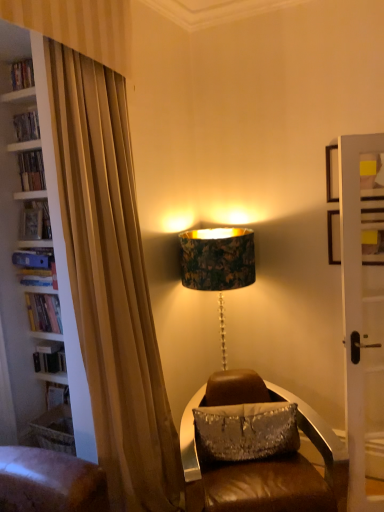
The width and height of the screenshot is (384, 512). What do you see at coordinates (44, 312) in the screenshot?
I see `hardcover book at left, the first book ordered from the bottom` at bounding box center [44, 312].

Describe the element at coordinates (35, 221) in the screenshot. I see `hardcover book at left, acting as the third book starting from the bottom` at that location.

The width and height of the screenshot is (384, 512). What do you see at coordinates (245, 431) in the screenshot?
I see `silver sequined pillow at center` at bounding box center [245, 431].

Image resolution: width=384 pixels, height=512 pixels. Describe the element at coordinates (262, 460) in the screenshot. I see `brown leather chair at center` at that location.

This screenshot has height=512, width=384. Describe the element at coordinates (36, 266) in the screenshot. I see `blue hardcover book at left, the 3th book positioned from the top` at that location.

Locate an element on the screen. The height and width of the screenshot is (512, 384). hardcover book at left, the first book ordered from the bottom is located at coordinates (44, 312).

Is blue hardcover book at left, which is the 2th book from bottom to top, positioned beyond the bounds of hardcover book at left, which is the 4th book in top-to-bottom order?

blue hardcover book at left, which is the 2th book from bottom to top, lies outside hardcover book at left, which is the 4th book in top-to-bottom order,'s area.

Is blue hardcover book at left, which is the 2th book from bottom to top, to the right of hardcover book at left, the first book ordered from the bottom, from the viewer's perspective?

In fact, blue hardcover book at left, which is the 2th book from bottom to top, is to the left of hardcover book at left, the first book ordered from the bottom.

Image resolution: width=384 pixels, height=512 pixels. Identify the location of book below the blue hardcover book at left, which is the 2th book from bottom to top (from the image's perspective). (44, 312).

Which is nearer, (17, 263) or (46, 324)?

Point (17, 263) is closer to the camera than point (46, 324).

Which of these two, brown leather chair at center or silver sequined pillow at center, is smaller?

silver sequined pillow at center.

Can you see brown leather chair at center touching silver sequined pillow at center?

brown leather chair at center and silver sequined pillow at center are not in contact.

In the scene shown: Considering the sizes of objects brown leather chair at center and silver sequined pillow at center in the image provided, who is wider, brown leather chair at center or silver sequined pillow at center?

brown leather chair at center.

Would you say brown leather chair at center is outside silver sequined pillow at center?

brown leather chair at center lies outside silver sequined pillow at center's area.

Is point (213, 382) closer to camera compared to point (26, 66)?

Yes, point (213, 382) is in front of point (26, 66).

From a real-world perspective, between brown leather chair at center and wooden bookshelf at upper left, who is vertically higher?

wooden bookshelf at upper left, from a real-world perspective.

From the image's perspective, would you say brown leather chair at center is shown under wooden bookshelf at upper left?

Yes, from the image's perspective, brown leather chair at center is below wooden bookshelf at upper left.

Who is taller, blue hardcover book at left, the 3th book positioned from the top, or silver sequined pillow at center?

With more height is silver sequined pillow at center.

Would you say blue hardcover book at left, the 3th book positioned from the top, is outside silver sequined pillow at center?

Yes.

Is blue hardcover book at left, which is the 2th book from bottom to top, to the right of silver sequined pillow at center from the viewer's perspective?

No.

Can you see blue hardcover book at left, the 3th book positioned from the top, touching silver sequined pillow at center?

blue hardcover book at left, the 3th book positioned from the top, and silver sequined pillow at center are not in contact.

How distant is hardcover book at left, acting as the third book starting from the bottom, from silver sequined pillow at center?

The distance of hardcover book at left, acting as the third book starting from the bottom, from silver sequined pillow at center is 5.31 feet.

From the picture: From the image's perspective, which one is positioned lower, hardcover book at left, which appears as the 2th book when viewed from the top, or silver sequined pillow at center?

From the image's view, silver sequined pillow at center is below.

Is point (20, 229) farther from camera compared to point (265, 435)?

Yes.

What's the angular difference between hardcover book at left, acting as the third book starting from the bottom, and silver sequined pillow at center's facing directions?

They differ by 26.6 degrees in their facing directions.

Is brown leather chair at center completely or partially outside of blue hardcover book at left, the 3th book positioned from the top?

brown leather chair at center is positioned outside blue hardcover book at left, the 3th book positioned from the top.

Are brown leather chair at center and blue hardcover book at left, which is the 2th book from bottom to top, located far from each other?

Yes.

Considering the sizes of objects brown leather chair at center and blue hardcover book at left, the 3th book positioned from the top, in the image provided, who is shorter, brown leather chair at center or blue hardcover book at left, the 3th book positioned from the top,?

Standing shorter between the two is blue hardcover book at left, the 3th book positioned from the top.

Measure the distance from brown leather chair at center to blue hardcover book at left, which is the 2th book from bottom to top.

brown leather chair at center and blue hardcover book at left, which is the 2th book from bottom to top, are 5.01 feet apart from each other.

How different are the orientations of silver sequined pillow at center and hardcover book at left, acting as the third book starting from the bottom, in degrees?

There is a 26.6-degree angle between the facing directions of silver sequined pillow at center and hardcover book at left, acting as the third book starting from the bottom.

Is silver sequined pillow at center aimed at hardcover book at left, acting as the third book starting from the bottom?

No, silver sequined pillow at center is not oriented towards hardcover book at left, acting as the third book starting from the bottom.

Is the surface of silver sequined pillow at center in direct contact with hardcover book at left, acting as the third book starting from the bottom?

No, silver sequined pillow at center is not with hardcover book at left, acting as the third book starting from the bottom.

How much distance is there between silver sequined pillow at center and hardcover book at left, which appears as the 2th book when viewed from the top?

silver sequined pillow at center is 1.62 meters away from hardcover book at left, which appears as the 2th book when viewed from the top.

You are a GUI agent. You are given a task and a screenshot of the screen. Output one action in this format:
    pyautogui.click(x=<x>, y=<y>)
    Task: Click on the book below the blue hardcover book at left, which is the 2th book from bottom to top (from a real-world perspective)
    
    Given the screenshot: What is the action you would take?
    pyautogui.click(x=44, y=312)

You are a GUI agent. You are given a task and a screenshot of the screen. Output one action in this format:
    pyautogui.click(x=<x>, y=<y>)
    Task: Click on the pillow above the brown leather chair at center (from a real-world perspective)
    The image size is (384, 512).
    Given the screenshot: What is the action you would take?
    pyautogui.click(x=245, y=431)

Looking at this image, considering their positions, is hardcover book at left, which is the 4th book in top-to-bottom order, positioned further to silver sequined pillow at center than blue hardcover book at left, which is the 2th book from bottom to top?

The object further to silver sequined pillow at center is blue hardcover book at left, which is the 2th book from bottom to top.

From the image, which object appears to be nearer to hardcover book at left, the first book ordered from the bottom, brown leather chair at center or blue hardcover book at left, the 3th book positioned from the top?

blue hardcover book at left, the 3th book positioned from the top, is positioned closer to the anchor hardcover book at left, the first book ordered from the bottom.

Looking at the image, which one is located closer to brown leather chair at center, hardcover book at left, positioned as the first book in top-to-bottom order, or hardcover book at left, acting as the third book starting from the bottom?

hardcover book at left, acting as the third book starting from the bottom, is closer to brown leather chair at center.

Based on their spatial positions, is brown leather chair at center or hardcover book at left, which is the 4th book in top-to-bottom order, closer to wooden bookshelf at upper left?

hardcover book at left, which is the 4th book in top-to-bottom order.

When comparing their distances from hardcover book at left, which is the fourth book in bottom-to-top order, does hardcover book at left, which appears as the 2th book when viewed from the top, or wooden bookshelf at upper left seem further?

wooden bookshelf at upper left lies further to hardcover book at left, which is the fourth book in bottom-to-top order, than the other object.

From the image, which object appears to be nearer to hardcover book at left, which is the fourth book in bottom-to-top order, brown leather chair at center or blue hardcover book at left, which is the 2th book from bottom to top?

Among the two, blue hardcover book at left, which is the 2th book from bottom to top, is located nearer to hardcover book at left, which is the fourth book in bottom-to-top order.

Based on their spatial positions, is hardcover book at left, which appears as the 2th book when viewed from the top, or brown leather chair at center closer to hardcover book at left, which is the fourth book in bottom-to-top order?

Based on the image, hardcover book at left, which appears as the 2th book when viewed from the top, appears to be nearer to hardcover book at left, which is the fourth book in bottom-to-top order.

Based on their spatial positions, is hardcover book at left, which is the 4th book in top-to-bottom order, or wooden bookshelf at upper left closer to silver sequined pillow at center?

hardcover book at left, which is the 4th book in top-to-bottom order.

Locate an element on the screen. The width and height of the screenshot is (384, 512). book between wooden bookshelf at upper left and hardcover book at left, acting as the third book starting from the bottom, in the vertical direction is located at coordinates (31, 170).

Locate an element on the screen. This screenshot has height=512, width=384. pillow between hardcover book at left, which is the fourth book in bottom-to-top order, and brown leather chair at center, in the vertical direction is located at coordinates (245, 431).

Locate an element on the screen. The image size is (384, 512). book between blue hardcover book at left, which is the 2th book from bottom to top, and brown leather chair at center is located at coordinates (44, 312).

Where is `book between blue hardcover book at left, the 3th book positioned from the top, and silver sequined pillow at center, in the horizontal direction`? This screenshot has width=384, height=512. book between blue hardcover book at left, the 3th book positioned from the top, and silver sequined pillow at center, in the horizontal direction is located at coordinates (44, 312).